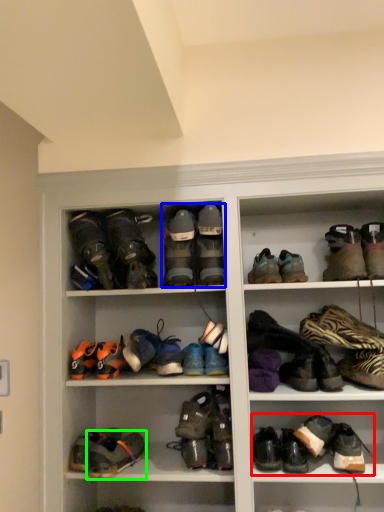
Question: Which is farther away from footwear (highlighted by a red box)? footwear (highlighted by a blue box) or footwear (highlighted by a green box)?

Choices:
 (A) footwear
 (B) footwear

Answer: (A)